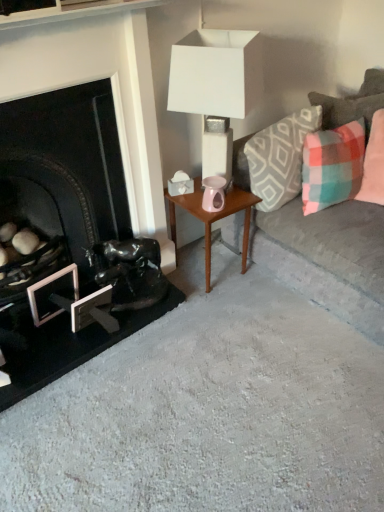
Question: Is plaid fabric pillow at right, which is counted as the 3th pillow, starting from the left, oriented towards metallic silver picture frame at lower left?

Choices:
 (A) no
 (B) yes

Answer: (A)

Question: Considering the relative positions of plaid fabric pillow at right, which is the first pillow in right-to-left order, and metallic silver picture frame at lower left in the image provided, is plaid fabric pillow at right, which is the first pillow in right-to-left order, in front of metallic silver picture frame at lower left?

Choices:
 (A) no
 (B) yes

Answer: (A)

Question: From a real-world perspective, does plaid fabric pillow at right, which is the first pillow in right-to-left order, sit lower than metallic silver picture frame at lower left?

Choices:
 (A) yes
 (B) no

Answer: (B)

Question: From the image's perspective, is plaid fabric pillow at right, which is the first pillow in right-to-left order, over metallic silver picture frame at lower left?

Choices:
 (A) no
 (B) yes

Answer: (B)

Question: Considering the relative sizes of plaid fabric pillow at right, which is counted as the 3th pillow, starting from the left, and metallic silver picture frame at lower left in the image provided, is plaid fabric pillow at right, which is counted as the 3th pillow, starting from the left, taller than metallic silver picture frame at lower left?

Choices:
 (A) yes
 (B) no

Answer: (A)

Question: From a real-world perspective, is plaid fabric pillow at upper right, the second pillow in the right-to-left sequence, above or below metallic silver picture frame at lower left?

Choices:
 (A) above
 (B) below

Answer: (A)

Question: In terms of size, does plaid fabric pillow at upper right, the 2th pillow when ordered from left to right, appear bigger or smaller than metallic silver picture frame at lower left?

Choices:
 (A) small
 (B) big

Answer: (B)

Question: Would you say plaid fabric pillow at upper right, the 2th pillow when ordered from left to right, is inside or outside metallic silver picture frame at lower left?

Choices:
 (A) outside
 (B) inside

Answer: (A)

Question: Considering the positions of plaid fabric pillow at upper right, the 2th pillow when ordered from left to right, and metallic silver picture frame at lower left in the image, is plaid fabric pillow at upper right, the 2th pillow when ordered from left to right, taller or shorter than metallic silver picture frame at lower left?

Choices:
 (A) short
 (B) tall

Answer: (A)

Question: In terms of height, does wooden side table at center look taller or shorter compared to plaid fabric pillow at upper right, the 2th pillow when ordered from left to right?

Choices:
 (A) tall
 (B) short

Answer: (A)

Question: From the image's perspective, is wooden side table at center located above or below plaid fabric pillow at upper right, the 2th pillow when ordered from left to right?

Choices:
 (A) above
 (B) below

Answer: (B)

Question: From a real-world perspective, is wooden side table at center positioned above or below plaid fabric pillow at upper right, the 2th pillow when ordered from left to right?

Choices:
 (A) below
 (B) above

Answer: (A)

Question: Based on their sizes in the image, would you say wooden side table at center is bigger or smaller than plaid fabric pillow at upper right, the 2th pillow when ordered from left to right?

Choices:
 (A) small
 (B) big

Answer: (B)

Question: From the image's perspective, is wooden side table at center above or below metallic silver picture frame at lower left?

Choices:
 (A) above
 (B) below

Answer: (A)

Question: Is wooden side table at center to the left or to the right of metallic silver picture frame at lower left in the image?

Choices:
 (A) left
 (B) right

Answer: (B)